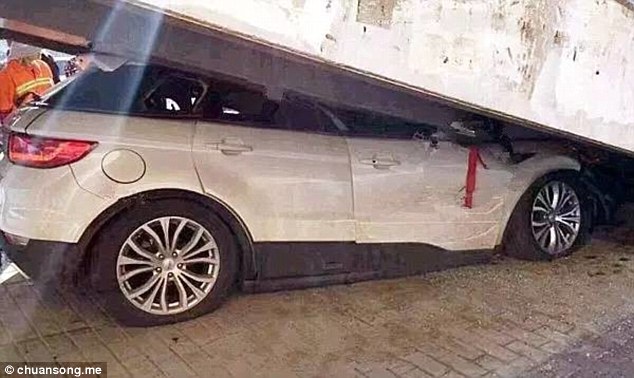
Locate an element on the screen. The width and height of the screenshot is (634, 378). building beam is located at coordinates pos(456,26).